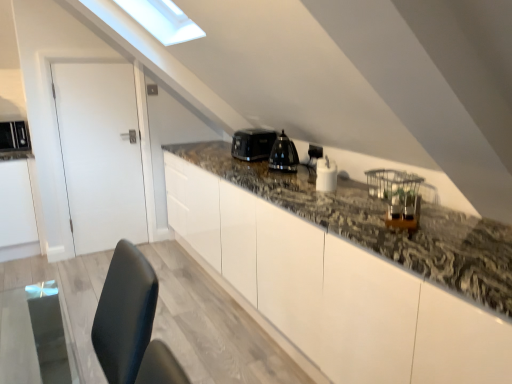
Find the location of `vacant area on top of white matte door at left (from a real-world perspective)`. vacant area on top of white matte door at left (from a real-world perspective) is located at coordinates (88, 56).